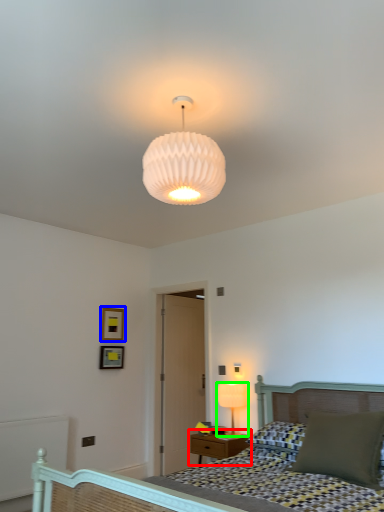
Question: Which object is the farthest from nightstand (highlighted by a red box)? Choose among these: picture frame (highlighted by a blue box) or lamp (highlighted by a green box).

Choices:
 (A) picture frame
 (B) lamp

Answer: (A)